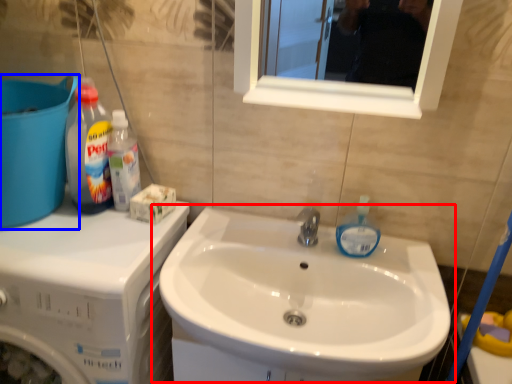
Question: Among these objects, which one is nearest to the camera, sink (highlighted by a red box) or water tank (highlighted by a blue box)?

Choices:
 (A) sink
 (B) water tank

Answer: (A)